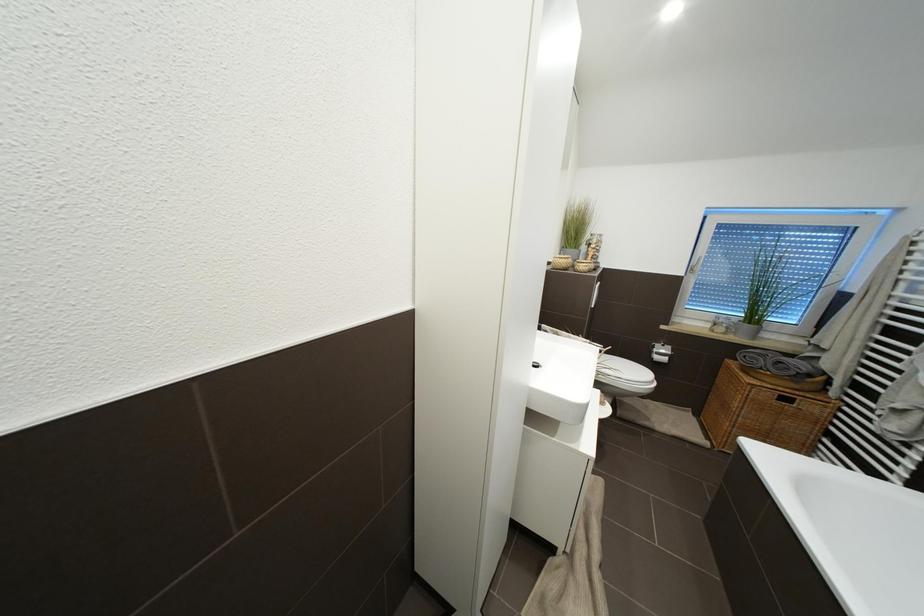
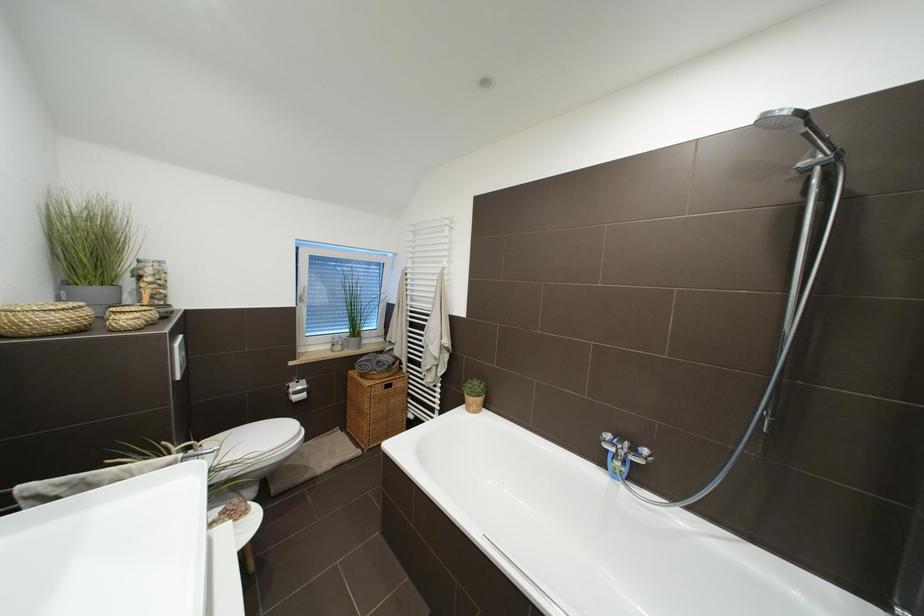
Question: The camera is either moving clockwise (left) or counter-clockwise (right) around the object. The first image is from the beginning of the video and the second image is from the end. Is the camera moving left or right when shooting the video?

Choices:
 (A) Left
 (B) Right

Answer: (A)